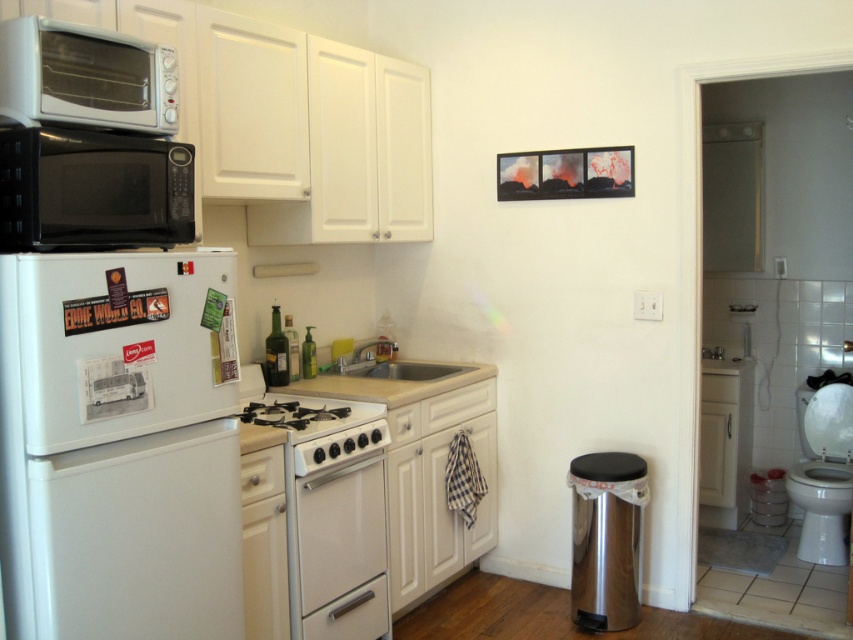
You are trying to determine which appliance is taller between the black matte microwave at upper left and the white glossy oven at center. Based on the scene, which one is taller?

The white glossy oven at center is taller than the black matte microwave at upper left.

Based on the photo, you are standing in the kitchen and want to reach the black matte microwave at upper left. Considering your height is 1.6 meters, can you comfortably reach it?

The black matte microwave at upper left is 1.71 meters from viewer. Since your height is 1.6 meters, you may not be able to comfortably reach it as it is slightly taller than your height.

You are standing in the kitchen and need to reach both the white glossy oven at center and the white glossy toilet bowl at lower right. Which one is closer to your left side?

The white glossy oven at center is positioned on the left side of the white glossy toilet bowl at lower right, so the white glossy oven at center is closer to your left side.